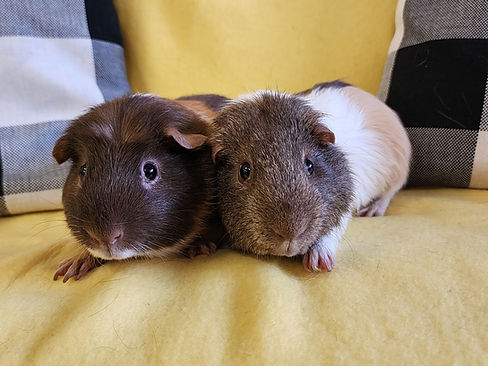
You are a GUI agent. You are given a task and a screenshot of the screen. Output one action in this format:
    pyautogui.click(x=<x>, y=<y>)
    Task: Click on the white fur
    This screenshot has width=488, height=366.
    Given the screenshot: What is the action you would take?
    pyautogui.click(x=359, y=175), pyautogui.click(x=342, y=137), pyautogui.click(x=345, y=109), pyautogui.click(x=388, y=130), pyautogui.click(x=375, y=154), pyautogui.click(x=395, y=172), pyautogui.click(x=332, y=239)